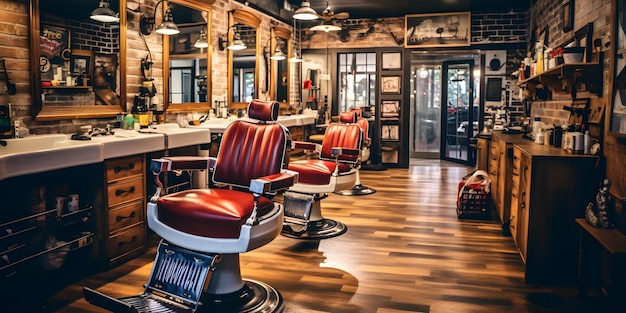
Where is `mirror`? mirror is located at coordinates (80, 52), (191, 47), (255, 69), (288, 71).